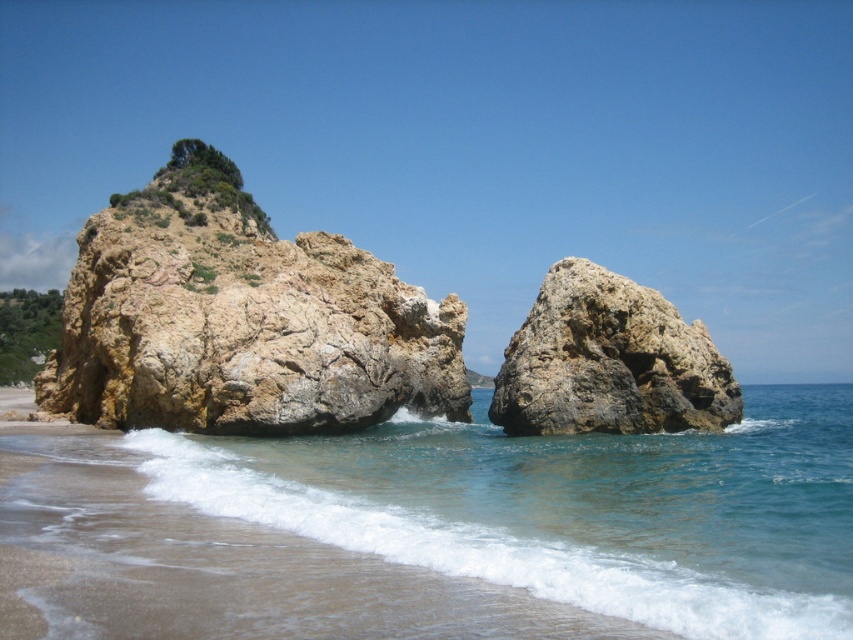
Can you confirm if clear blue water at lower left is wider than rustic stone rock at left?

Yes, clear blue water at lower left is wider than rustic stone rock at left.

Based on the photo, can you confirm if clear blue water at lower left is positioned to the left of rustic stone rock at left?

No, clear blue water at lower left is not to the left of rustic stone rock at left.

What do you see at coordinates (570, 508) in the screenshot? I see `clear blue water at lower left` at bounding box center [570, 508].

This screenshot has width=853, height=640. What are the coordinates of `clear blue water at lower left` in the screenshot? It's located at (570, 508).

Is rustic stone rock at left bigger than rusty brown rock at center?

Correct, rustic stone rock at left is larger in size than rusty brown rock at center.

Which is behind, point (399, 332) or point (572, 266)?

The point (399, 332) is more distant.

From the picture: Measure the distance between rustic stone rock at left and camera.

rustic stone rock at left is 60.85 meters away from camera.

Locate an element on the screen. The image size is (853, 640). rustic stone rock at left is located at coordinates (241, 320).

Does clear blue water at lower left have a greater width compared to rusty brown rock at center?

Yes.

Does point (433, 464) come behind point (677, 419)?

No, it is in front of (677, 419).

Is point (415, 515) positioned before point (514, 388)?

Yes, it is.

Locate an element on the screen. clear blue water at lower left is located at coordinates (570, 508).